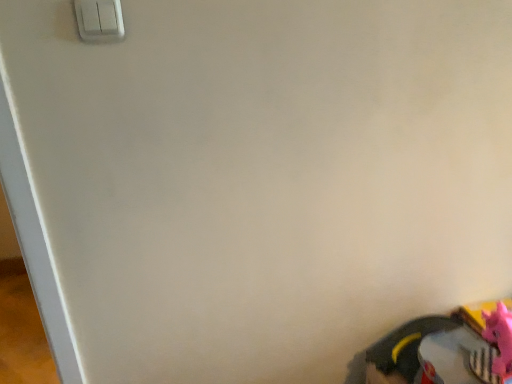
Question: Is white plastic light switch at upper left not inside rubberized black shoe at lower right?

Choices:
 (A) yes
 (B) no

Answer: (A)

Question: Does white plastic light switch at upper left have a lesser height compared to rubberized black shoe at lower right?

Choices:
 (A) yes
 (B) no

Answer: (A)

Question: From a real-world perspective, does white plastic light switch at upper left stand above rubberized black shoe at lower right?

Choices:
 (A) no
 (B) yes

Answer: (B)

Question: Does white plastic light switch at upper left turn towards rubberized black shoe at lower right?

Choices:
 (A) no
 (B) yes

Answer: (A)

Question: From the image's perspective, would you say white plastic light switch at upper left is shown under rubberized black shoe at lower right?

Choices:
 (A) yes
 (B) no

Answer: (B)

Question: Considering the relative sizes of white plastic light switch at upper left and rubberized black shoe at lower right in the image provided, is white plastic light switch at upper left taller than rubberized black shoe at lower right?

Choices:
 (A) no
 (B) yes

Answer: (A)

Question: From the image's perspective, is rubberized black shoe at lower right on pink rubber toy at lower right?

Choices:
 (A) no
 (B) yes

Answer: (A)

Question: Does rubberized black shoe at lower right have a smaller size compared to pink rubber toy at lower right?

Choices:
 (A) yes
 (B) no

Answer: (B)

Question: From a real-world perspective, is rubberized black shoe at lower right beneath pink rubber toy at lower right?

Choices:
 (A) yes
 (B) no

Answer: (A)

Question: Is rubberized black shoe at lower right turned away from pink rubber toy at lower right?

Choices:
 (A) yes
 (B) no

Answer: (B)

Question: Is rubberized black shoe at lower right to the right of pink rubber toy at lower right from the viewer's perspective?

Choices:
 (A) yes
 (B) no

Answer: (B)

Question: Is rubberized black shoe at lower right further to camera compared to pink rubber toy at lower right?

Choices:
 (A) yes
 (B) no

Answer: (A)

Question: Is white plastic light switch at upper left positioned before pink rubber toy at lower right?

Choices:
 (A) yes
 (B) no

Answer: (A)